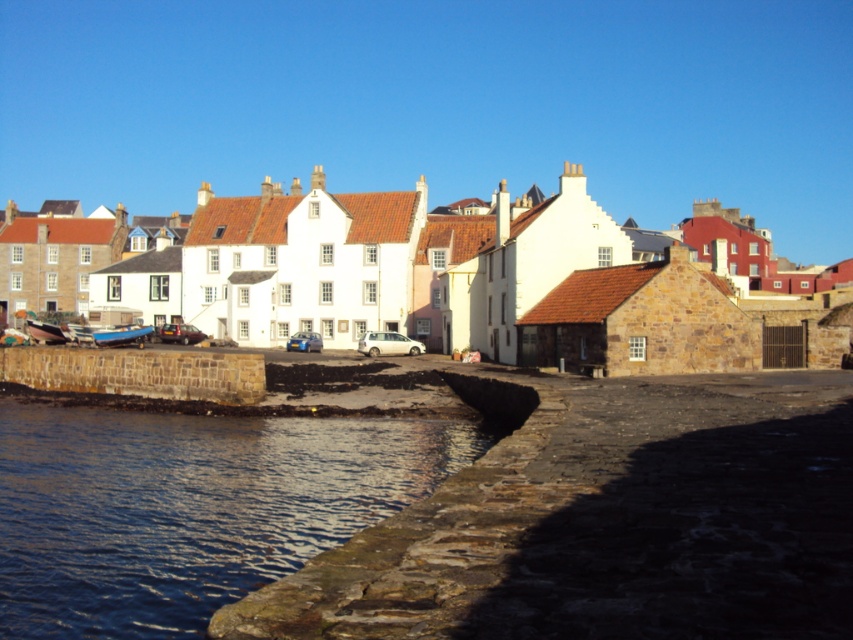
Question: Is brown stone wall at lower left to the right of metallic blue boat at lower left from the viewer's perspective?

Choices:
 (A) no
 (B) yes

Answer: (B)

Question: Among these objects, which one is farthest from the camera?

Choices:
 (A) clear water at lower left
 (B) white stone houses at center

Answer: (B)

Question: Is clear water at lower left thinner than metallic blue boat at lower left?

Choices:
 (A) yes
 (B) no

Answer: (B)

Question: Which object is the farthest from the clear water at lower left?

Choices:
 (A) brown stone wall at lower left
 (B) metallic blue boat at lower left
 (C) white stone houses at center

Answer: (C)

Question: Is brown stone wall at lower left above metallic blue boat at lower left?

Choices:
 (A) no
 (B) yes

Answer: (A)

Question: Which point is farther to the camera?

Choices:
 (A) metallic blue boat at lower left
 (B) white stone houses at center

Answer: (A)